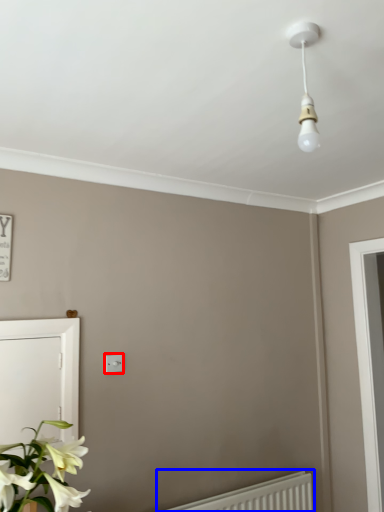
Question: Which point is closer to the camera, light switch (highlighted by a red box) or radiator (highlighted by a blue box)?

Choices:
 (A) light switch
 (B) radiator

Answer: (B)